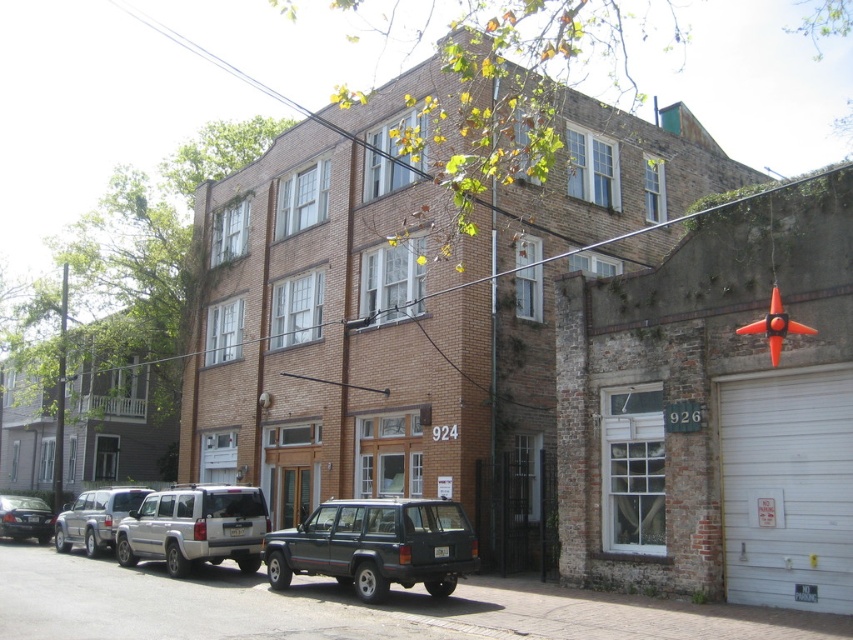
Is dark gray matte suv at center behind matte black sedan at lower left?

No, it is not.

Is point (277, 589) in front of point (4, 532)?

Yes, point (277, 589) is in front of point (4, 532).

The width and height of the screenshot is (853, 640). Find the location of `dark gray matte suv at center`. dark gray matte suv at center is located at coordinates [376, 545].

Is silver metallic suv at lower left positioned at the back of matte black sedan at lower left?

No, silver metallic suv at lower left is in front of matte black sedan at lower left.

Can you confirm if silver metallic suv at lower left is thinner than matte black sedan at lower left?

Correct, silver metallic suv at lower left's width is less than matte black sedan at lower left's.

Which is in front, point (189, 563) or point (35, 506)?

Positioned in front is point (189, 563).

Where is `silver metallic suv at lower left`? The image size is (853, 640). silver metallic suv at lower left is located at coordinates (195, 528).

Who is positioned more to the left, silver metallic suv at lower left or silver metallic suv at center?

From the viewer's perspective, silver metallic suv at center appears more on the left side.

Which is above, silver metallic suv at lower left or silver metallic suv at center?

silver metallic suv at lower left is above.

This screenshot has width=853, height=640. Describe the element at coordinates (195, 528) in the screenshot. I see `silver metallic suv at lower left` at that location.

The width and height of the screenshot is (853, 640). In order to click on silver metallic suv at lower left in this screenshot , I will do `click(195, 528)`.